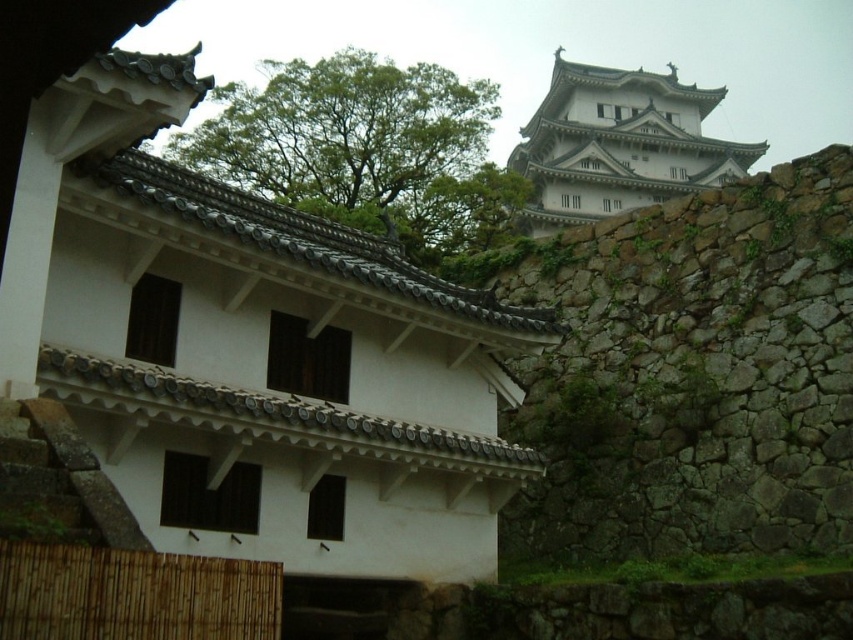
You are a visitor standing in front of the white building with a tiled roof. You want to take a photo of the white tile roof at center and the white stone tower at upper center. Which object will appear larger in your photo?

The white stone tower at upper center will appear larger in the photo because it is taller than the white tile roof at center.